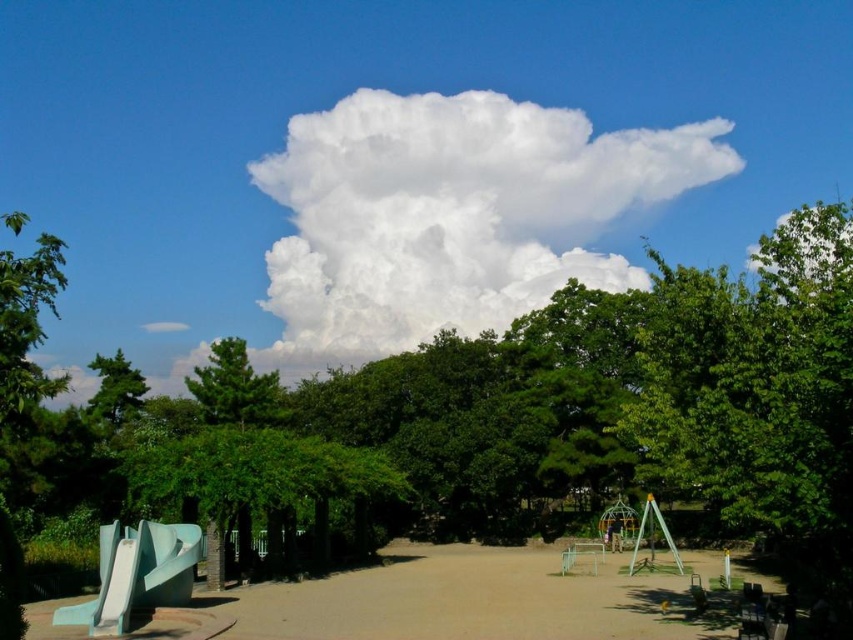
Question: Which of the following is the farthest from the observer?

Choices:
 (A) green leafy tree at upper center
 (B) white fluffy cloud at upper center
 (C) light blue smooth slide at lower left

Answer: (B)

Question: Can you confirm if green leafy tree at upper center is positioned below light blue smooth slide at lower left?

Choices:
 (A) yes
 (B) no

Answer: (B)

Question: Can you confirm if white fluffy cloud at upper center is positioned below smooth concrete path at center?

Choices:
 (A) no
 (B) yes

Answer: (A)

Question: Which of the following is the farthest from the observer?

Choices:
 (A) (115, 579)
 (B) (300, 586)
 (C) (445, 324)
 (D) (109, 442)

Answer: (C)

Question: Is light blue smooth slide at lower left behind green plastic bench at center?

Choices:
 (A) yes
 (B) no

Answer: (B)

Question: Among these points, which one is nearest to the camera?

Choices:
 (A) (138, 384)
 (B) (169, 596)
 (C) (483, 560)

Answer: (B)